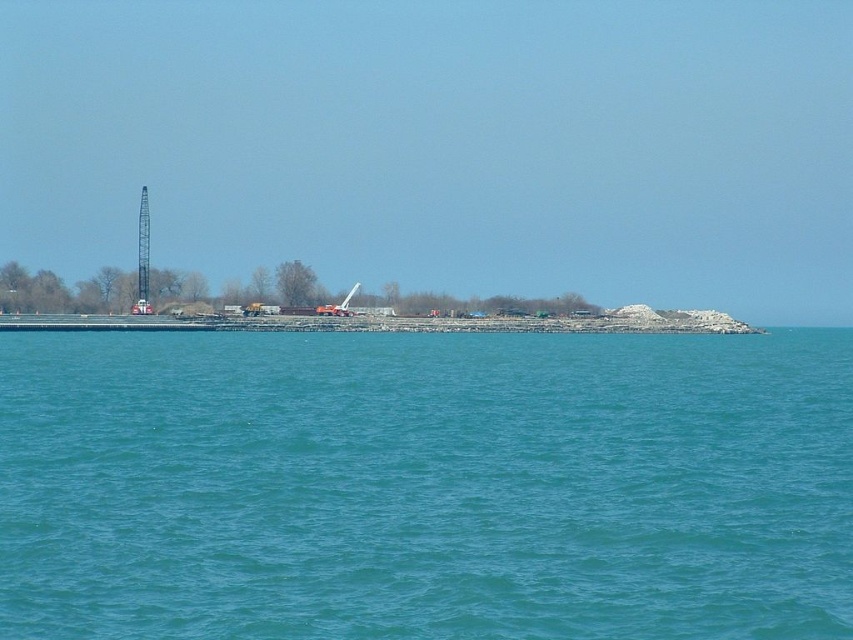
Question: Which point is closer to the camera?

Choices:
 (A) metallic gray crane at left
 (B) blue water at center
 (C) metallic crane at center

Answer: (B)

Question: Which of the following is the farthest from the observer?

Choices:
 (A) metallic crane at center
 (B) metallic gray crane at left

Answer: (B)

Question: Can you confirm if blue water at center is smaller than metallic crane at center?

Choices:
 (A) no
 (B) yes

Answer: (A)

Question: Does metallic gray crane at left have a larger size compared to metallic crane at center?

Choices:
 (A) yes
 (B) no

Answer: (A)

Question: Which point is closer to the camera?

Choices:
 (A) (549, 339)
 (B) (144, 275)

Answer: (A)

Question: Can you confirm if metallic gray crane at left is wider than metallic crane at center?

Choices:
 (A) yes
 (B) no

Answer: (A)